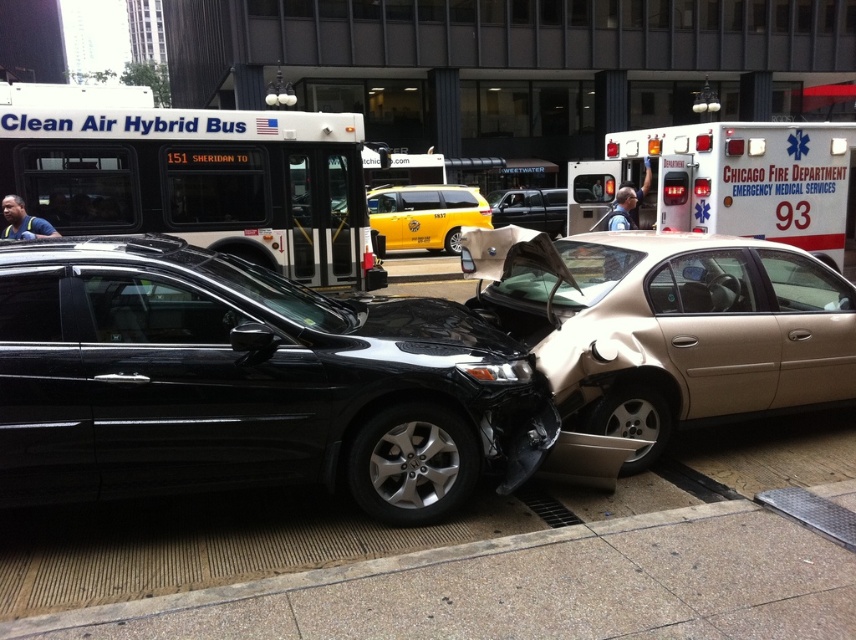
You are a traffic officer assessing the accident scene. The glossy black sedan at center and the white matte bus at upper left are both involved. Which vehicle is larger in size?

The glossy black sedan at center is bigger than the white matte bus at upper left according to the description.

You are a pedestrian standing at the scene of the accident. You need to cross the street to reach the white matte bus at upper left. The road is 10 meters wide. Can you safely cross the road before the glossy black sedan at center arrives?

The glossy black sedan at center is currently 8.53 meters away from the white matte bus at upper left. Since the road is 10 meters wide, the distance between the sedan and the bus is less than the road width. Therefore, the sedan would have to stop or slow down before reaching the bus. As a pedestrian, you can safely cross the road before the glossy black sedan at center arrives, provided you move quickly.